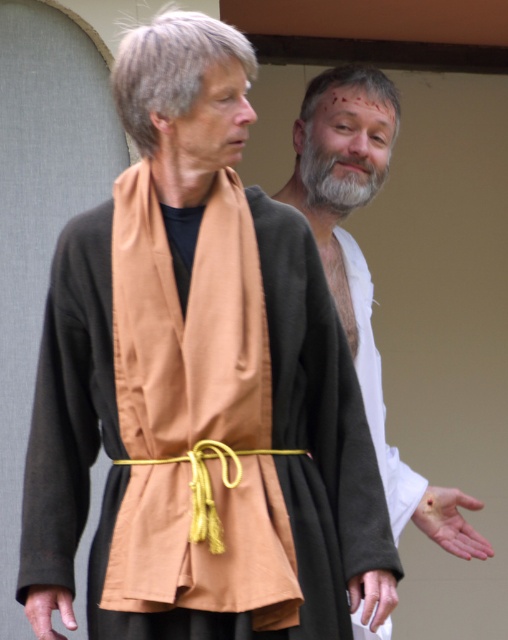
Question: Which point is farther to the camera?

Choices:
 (A) (329, 176)
 (B) (382, 113)

Answer: (B)

Question: Does white matte shirt at upper right have a smaller size compared to gray matte beard at center?

Choices:
 (A) yes
 (B) no

Answer: (B)

Question: Is the position of white matte shirt at upper right less distant than that of gray matte beard at center?

Choices:
 (A) no
 (B) yes

Answer: (B)

Question: Is white matte shirt at upper right wider than gray matte beard at center?

Choices:
 (A) yes
 (B) no

Answer: (A)